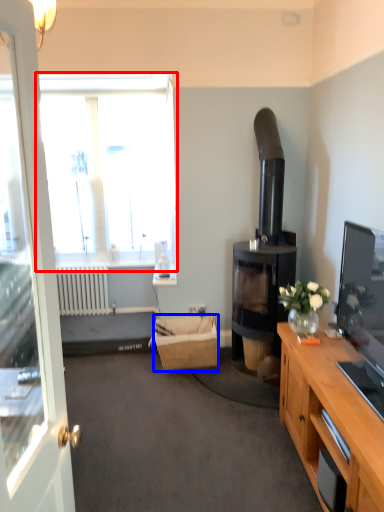
Question: Which object is further to the camera taking this photo, window (highlighted by a red box) or picnic basket (highlighted by a blue box)?

Choices:
 (A) window
 (B) picnic basket

Answer: (A)